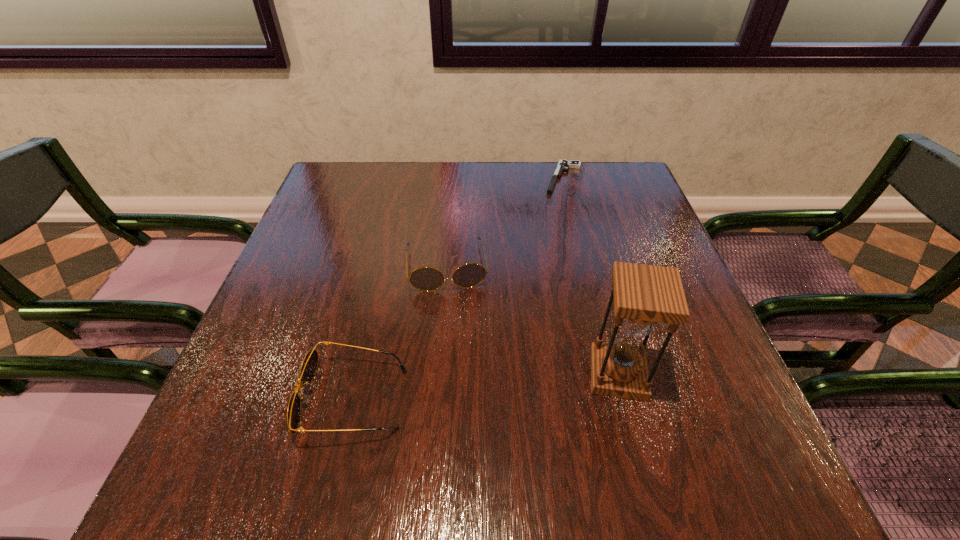
In order to click on free spot located 0.250m on the front-facing side of the pistol in this screenshot , I will do `click(542, 249)`.

Identify the location of vacant space situated 0.330m on the front-facing side of the pistol. The height and width of the screenshot is (540, 960). (x=536, y=271).

Where is `vacant space situated on the lenses of the farther sunglasses`? vacant space situated on the lenses of the farther sunglasses is located at coordinates (452, 309).

This screenshot has width=960, height=540. Identify the location of vacant area situated 0.200m on the lenses of the farther sunglasses. (459, 368).

At what (x,y) coordinates should I click in order to perform the action: click on vacant space located on the lenses of the farther sunglasses. Please return your answer as a coordinate pair (x, y). The image size is (960, 540). Looking at the image, I should click on (456, 347).

The height and width of the screenshot is (540, 960). In order to click on object that is at the far edge in this screenshot , I will do `click(563, 165)`.

Locate an element on the screen. This screenshot has height=540, width=960. sunglasses that is at the near edge is located at coordinates (309, 365).

This screenshot has height=540, width=960. What are the coordinates of `hourglass that is at the near edge` in the screenshot? It's located at (644, 295).

Where is `object at the left edge`? object at the left edge is located at coordinates (309, 365).

You are a GUI agent. You are given a task and a screenshot of the screen. Output one action in this format:
    pyautogui.click(x=<x>, y=<y>)
    Task: Click on the hourglass that is at the right edge
    The image size is (960, 540).
    Given the screenshot: What is the action you would take?
    pyautogui.click(x=644, y=295)